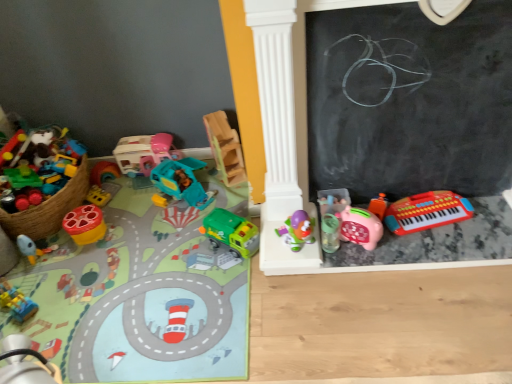
Identify the location of vacant area that lies between shiny plastic toy at left, arranged as the 3th toy when viewed from the left, and matte plastic toy rocket at lower left, the first toy from the left. Image resolution: width=512 pixels, height=384 pixels. (67, 247).